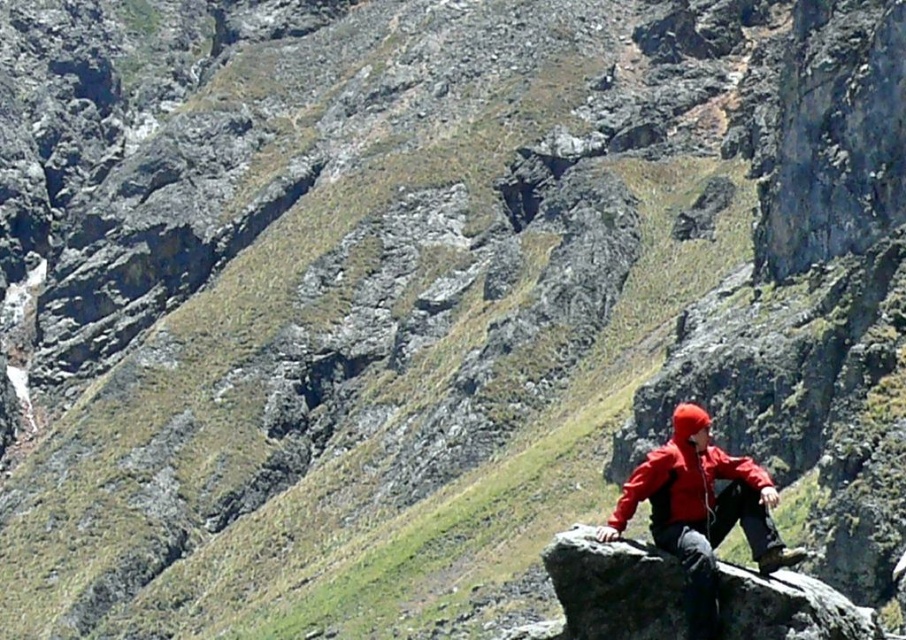
You are standing at the camera position and want to reach the point marked as point (680, 502). If your walking speed is 1.5 meters per second, how many seconds will it take you to reach that point?

The distance between the camera and point (680, 502) is 44.88 meters. At a walking speed of 1.5 meters per second, it will take 44.88 divided by 1.5, which equals approximately 29.92 seconds. So, it will take about 30 seconds to reach the point.

You are standing at the base of the mountain and see two points marked on the slope. The first point is at coordinates point (567, 582) and the second is at point (711, 460). Which point is closer to you?

Point (567, 582) is closer to the viewer than point (711, 460).

You are navigating a mountain trail and see two points marked on your map. The first point is at coordinate point(557, 596) and the second is at point(754, 538). Based on the mountainous terrain described, which point is closer to you if you are facing the direction of the person sitting on the large flat rock?

Point(754, 538) is closer to you because it is in front of point(557, 596) when facing the direction of the person sitting on the large flat rock.